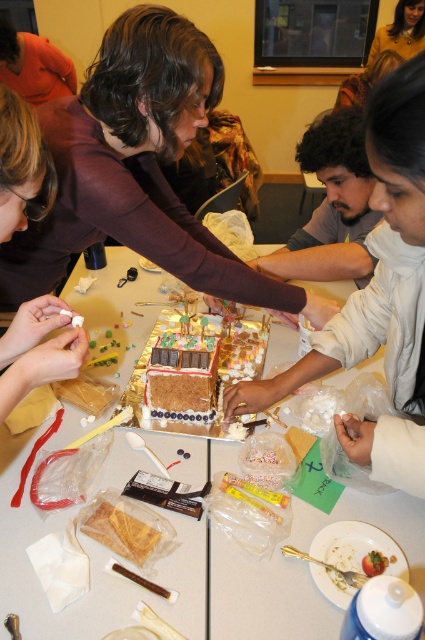
Question: Among these objects, which one is farthest from the camera?

Choices:
 (A) matte brown hair at center
 (B) matte white marshmallow at center
 (C) orange fabric shirt at upper left
 (D) dark curly hair at center

Answer: (C)

Question: Estimate the real-world distances between objects in this image. Which object is closer to the orange fabric shirt at upper left?

Choices:
 (A) white matte marshmallow at center
 (B) white plastic table at center
 (C) dark curly hair at center

Answer: (B)

Question: Which of these objects is positioned farthest from the candy-coated chocolate cake at center?

Choices:
 (A) dark curly hair at center
 (B) orange fabric shirt at upper left
 (C) white matte marshmallow at center

Answer: (B)

Question: Can you confirm if white matte marshmallow at center is positioned above matte white marshmallow at center?

Choices:
 (A) yes
 (B) no

Answer: (B)

Question: Is matte brown hair at center above orange fabric shirt at upper left?

Choices:
 (A) yes
 (B) no

Answer: (B)

Question: Can you confirm if white matte marshmallow at center is thinner than matte white marshmallow at center?

Choices:
 (A) yes
 (B) no

Answer: (B)